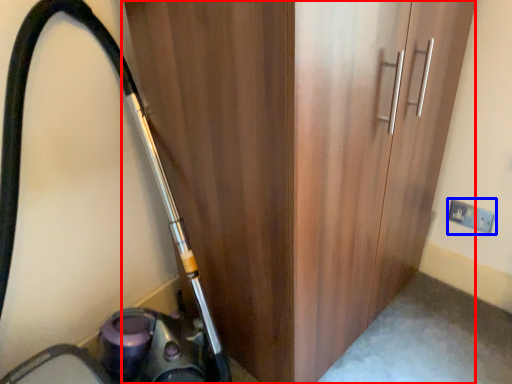
Question: Among these objects, which one is farthest to the camera, door (highlighted by a red box) or electric outlet (highlighted by a blue box)?

Choices:
 (A) door
 (B) electric outlet

Answer: (B)